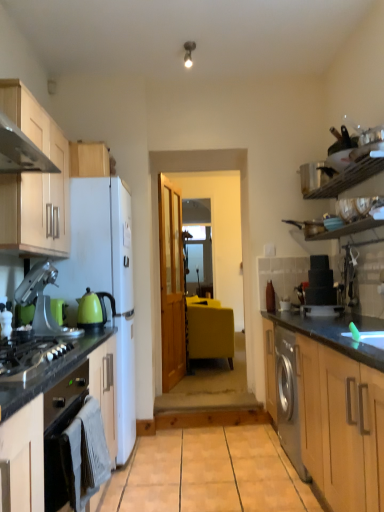
Question: In terms of width, does white glossy plate at right, the first appliance in the bottom-to-top sequence, look wider or thinner when compared to transparent glass door at center?

Choices:
 (A) thin
 (B) wide

Answer: (B)

Question: From their relative heights in the image, would you say white glossy plate at right, which is counted as the second appliance, starting from the top, is taller or shorter than transparent glass door at center?

Choices:
 (A) short
 (B) tall

Answer: (A)

Question: Considering the real-world distances, which object is closest to the white matte refrigerator at left?

Choices:
 (A) yellow fabric couch at center
 (B) green glossy kettle at left
 (C) light wood cabinet at upper left, the third cabinetry in the bottom-to-top sequence
 (D) transparent glass door at center
 (E) stainless steel gas stove at lower left

Answer: (B)

Question: Which of these objects is positioned closest to the matte black oven at left, the first cabinetry ordered from the bottom?

Choices:
 (A) black plastic coffee machine at right, the 1th coffee machine in the right-to-left sequence
 (B) stainless steel gas stove at lower left
 (C) white matte refrigerator at left
 (D) yellow fabric couch at center
 (E) black granite countertop at right

Answer: (B)